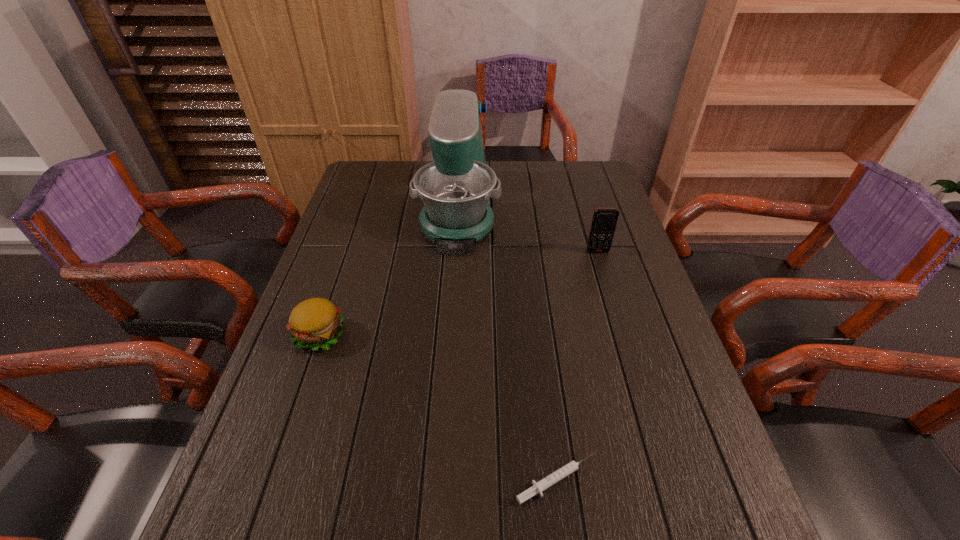
Identify the location of free space that satisfies the following two spatial constraints: 1. on the front-facing side of the shortest object; 2. on the right side of the mixer. (441, 480).

Locate an element on the screen. The height and width of the screenshot is (540, 960). free spot that satisfies the following two spatial constraints: 1. on the front-facing side of the tallest object; 2. on the right side of the syringe is located at coordinates (441, 480).